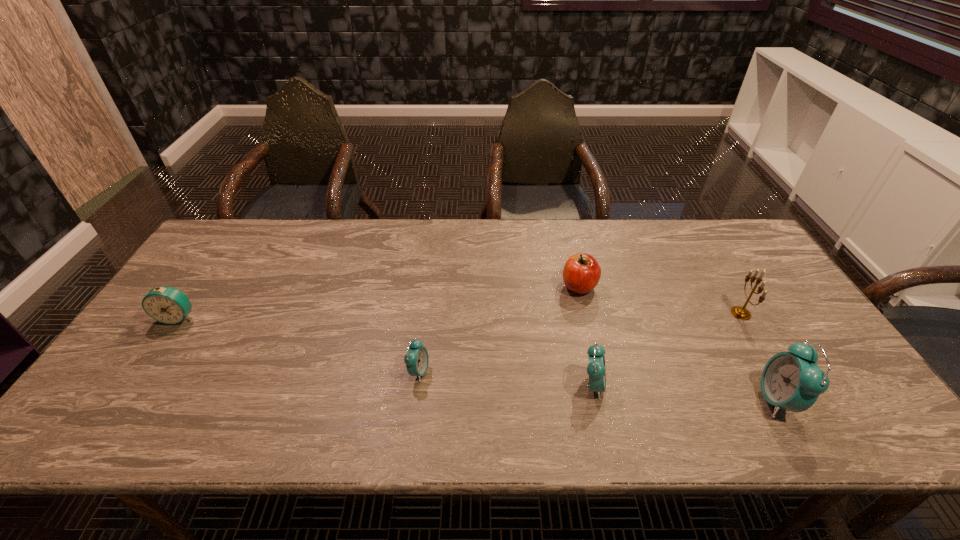
Find the location of `free space at the far edge of the desktop`. free space at the far edge of the desktop is located at coordinates (366, 235).

Where is `free space at the near edge of the desktop`? The width and height of the screenshot is (960, 540). free space at the near edge of the desktop is located at coordinates (759, 380).

This screenshot has width=960, height=540. Find the location of `vacant space at the left edge of the desktop`. vacant space at the left edge of the desktop is located at coordinates (137, 342).

Where is `vacant space at the right edge`? This screenshot has width=960, height=540. vacant space at the right edge is located at coordinates (782, 318).

Where is `vacant space at the far right corner`? The height and width of the screenshot is (540, 960). vacant space at the far right corner is located at coordinates (755, 262).

You are a GUI agent. You are given a task and a screenshot of the screen. Output one action in this format:
    pyautogui.click(x=<x>, y=<y>)
    Task: Click on the blank region between the rightmost alarm clock and the candelabrum
    
    Given the screenshot: What is the action you would take?
    pyautogui.click(x=759, y=356)

This screenshot has height=540, width=960. I want to click on free spot between the third alarm clock from left to right and the third alarm clock from right to left, so click(506, 379).

Where is `vacant area between the third alarm clock from left to right and the second object from left to right`? vacant area between the third alarm clock from left to right and the second object from left to right is located at coordinates click(506, 379).

What are the coordinates of `free space between the rightmost alarm clock and the farthest object` in the screenshot? It's located at point(678,343).

The image size is (960, 540). What are the coordinates of `vacant area that lies between the candelabrum and the shortest alarm clock` in the screenshot? It's located at (580, 342).